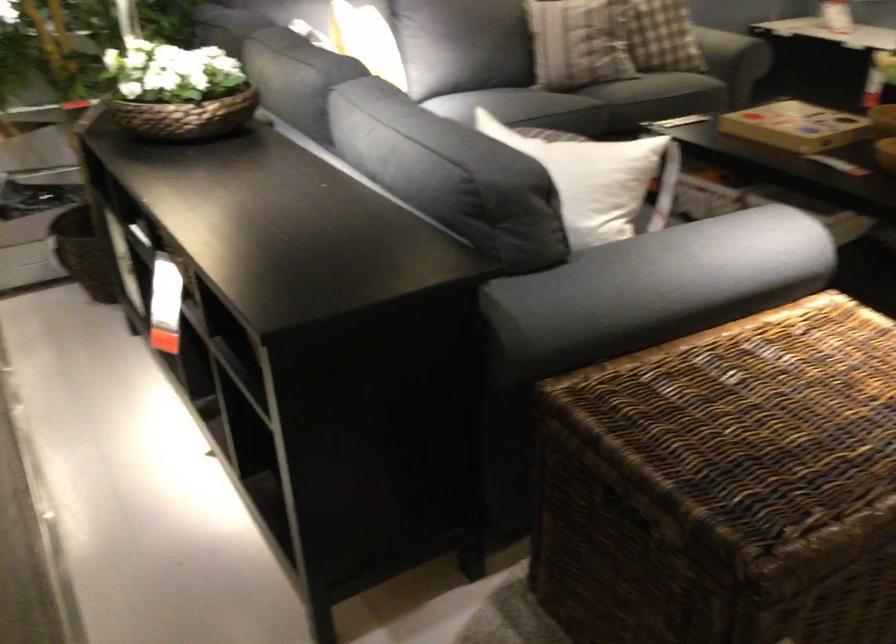
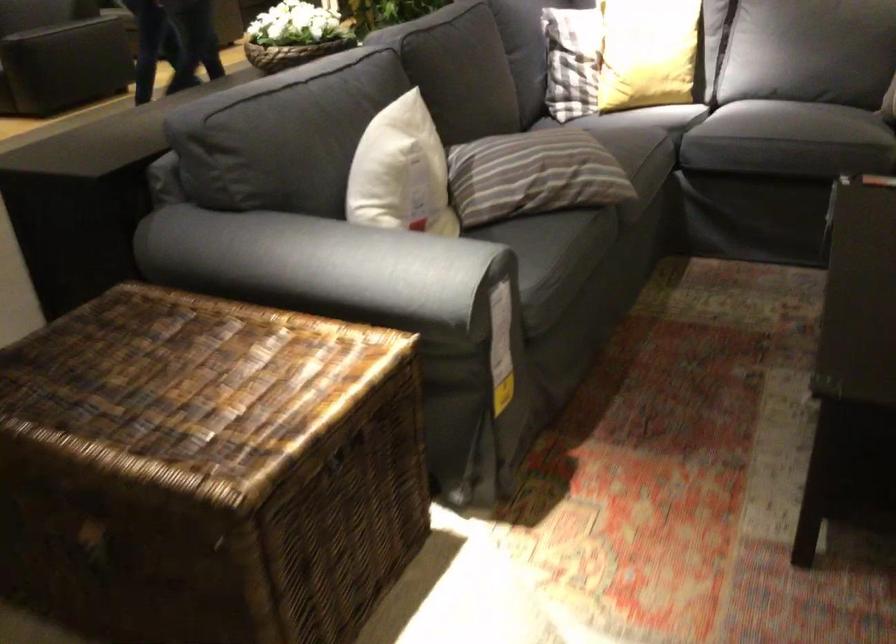
Find the pixel in the second image that matches point (567, 107) in the first image.

(768, 122)